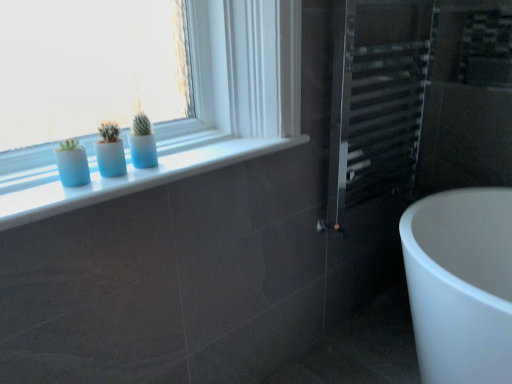
Question: From a real-world perspective, does white glossy window sill at upper center stand above metallic silver radiator at right?

Choices:
 (A) no
 (B) yes

Answer: (B)

Question: Would you say white glossy window sill at upper center is outside metallic silver radiator at right?

Choices:
 (A) no
 (B) yes

Answer: (B)

Question: Considering the relative sizes of white glossy window sill at upper center and metallic silver radiator at right in the image provided, is white glossy window sill at upper center wider than metallic silver radiator at right?

Choices:
 (A) no
 (B) yes

Answer: (B)

Question: Considering the relative sizes of white glossy window sill at upper center and metallic silver radiator at right in the image provided, is white glossy window sill at upper center taller than metallic silver radiator at right?

Choices:
 (A) no
 (B) yes

Answer: (A)

Question: Can you confirm if white glossy window sill at upper center is positioned to the right of metallic silver radiator at right?

Choices:
 (A) yes
 (B) no

Answer: (B)

Question: From the image's perspective, is white glossy window sill at upper center located above or below matte blue vase at left?

Choices:
 (A) below
 (B) above

Answer: (B)

Question: From their relative heights in the image, would you say white glossy window sill at upper center is taller or shorter than matte blue vase at left?

Choices:
 (A) tall
 (B) short

Answer: (B)

Question: Considering the positions of white glossy window sill at upper center and matte blue vase at left in the image, is white glossy window sill at upper center wider or thinner than matte blue vase at left?

Choices:
 (A) wide
 (B) thin

Answer: (A)

Question: Relative to matte blue vase at left, is white glossy window sill at upper center in front or behind?

Choices:
 (A) front
 (B) behind

Answer: (A)

Question: Considering the relative positions of white glossy window sill at upper center and metallic silver radiator at right in the image provided, is white glossy window sill at upper center to the left or to the right of metallic silver radiator at right?

Choices:
 (A) right
 (B) left

Answer: (B)

Question: From a real-world perspective, is white glossy window sill at upper center positioned above or below metallic silver radiator at right?

Choices:
 (A) above
 (B) below

Answer: (A)

Question: Considering the positions of white glossy window sill at upper center and metallic silver radiator at right in the image, is white glossy window sill at upper center wider or thinner than metallic silver radiator at right?

Choices:
 (A) thin
 (B) wide

Answer: (B)

Question: Choose the correct answer: Is white glossy window sill at upper center inside metallic silver radiator at right or outside it?

Choices:
 (A) outside
 (B) inside

Answer: (A)

Question: From a real-world perspective, relative to white glossy window sill at upper center, is metallic silver radiator at right vertically above or below?

Choices:
 (A) below
 (B) above

Answer: (A)

Question: Considering the positions of point (380, 225) and point (70, 200), is point (380, 225) closer or farther from the camera than point (70, 200)?

Choices:
 (A) farther
 (B) closer

Answer: (A)